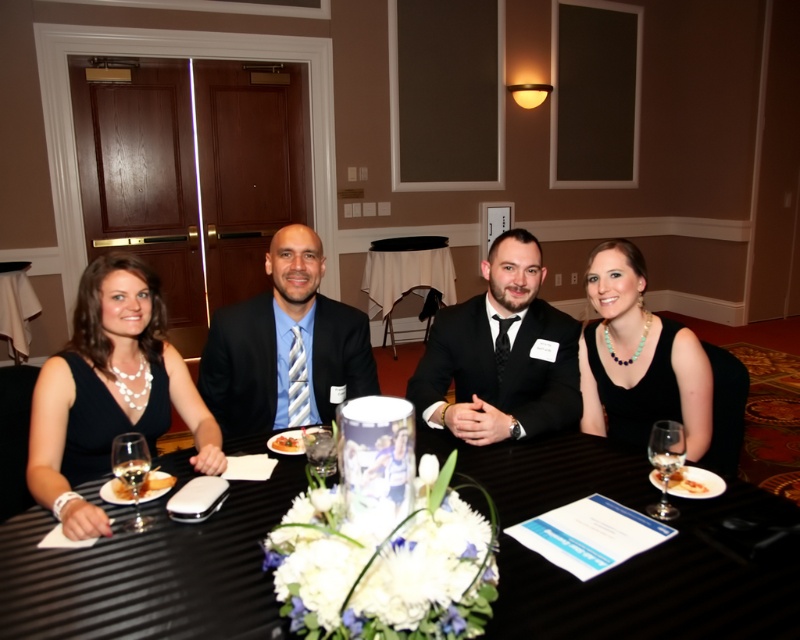
You are sitting at the rectangular table in the formal event. There are two points marked on the table. One is at coordinate point (320,337) and the other at point (436,307). If you want to place a napkin between these two points, which point should the napkin be closer to in order to be in front of the other point?

The napkin should be closer to point (320,337) because it is in front of point (436,307).